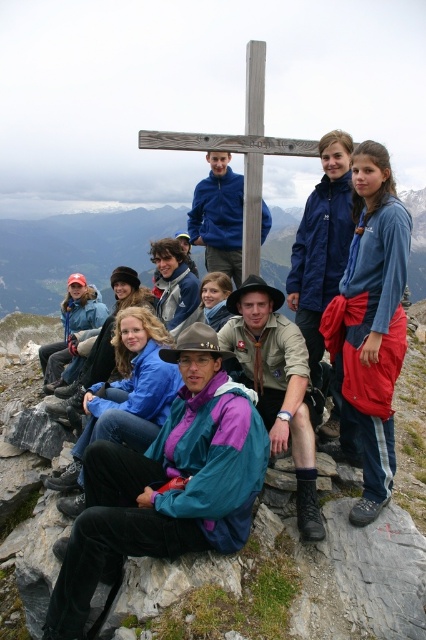
Is point (389, 406) positioned in front of point (245, 168)?

Yes, point (389, 406) is closer to viewer.

You are a GUI agent. You are given a task and a screenshot of the screen. Output one action in this format:
    pyautogui.click(x=<x>, y=<y>)
    Task: Click on the blue fleece jacket at upper right
    This screenshot has width=426, height=640.
    Given the screenshot: What is the action you would take?
    pyautogui.click(x=371, y=321)

Who is shorter, teal nylon jacket at center or wooden cross at center?

With less height is teal nylon jacket at center.

Is teal nylon jacket at center positioned before wooden cross at center?

Yes, it is.

Where is `teal nylon jacket at center`? This screenshot has height=640, width=426. teal nylon jacket at center is located at coordinates (166, 484).

You are a GUI agent. You are given a task and a screenshot of the screen. Output one action in this format:
    pyautogui.click(x=<x>, y=<y>)
    Task: Click on the teal nylon jacket at center
    
    Given the screenshot: What is the action you would take?
    pyautogui.click(x=166, y=484)

Is teal nylon jacket at center taller than blue fleece jacket at upper right?

Incorrect, teal nylon jacket at center's height is not larger of blue fleece jacket at upper right's.

From the picture: Is teal nylon jacket at center below blue fleece jacket at upper right?

Yes, teal nylon jacket at center is below blue fleece jacket at upper right.

The height and width of the screenshot is (640, 426). Identify the location of teal nylon jacket at center. (166, 484).